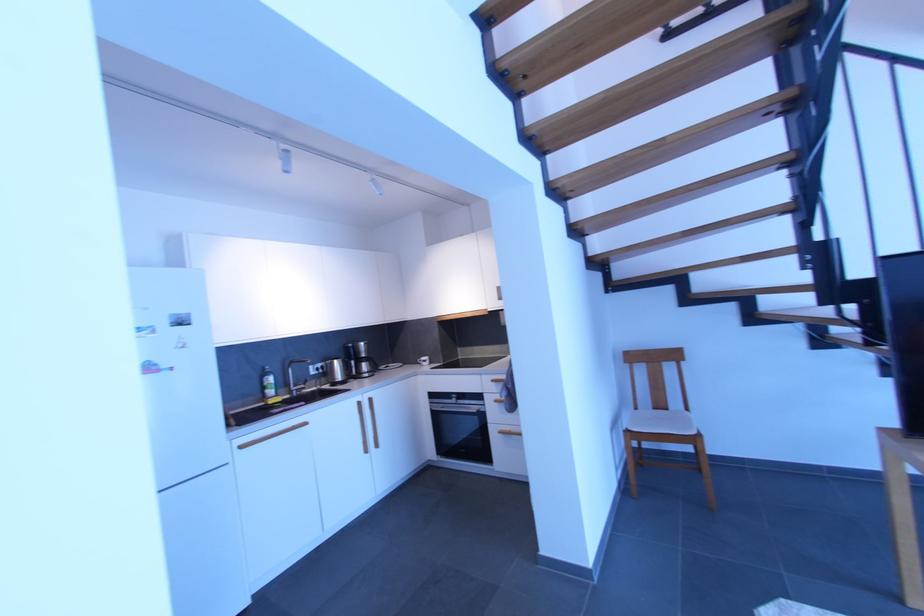
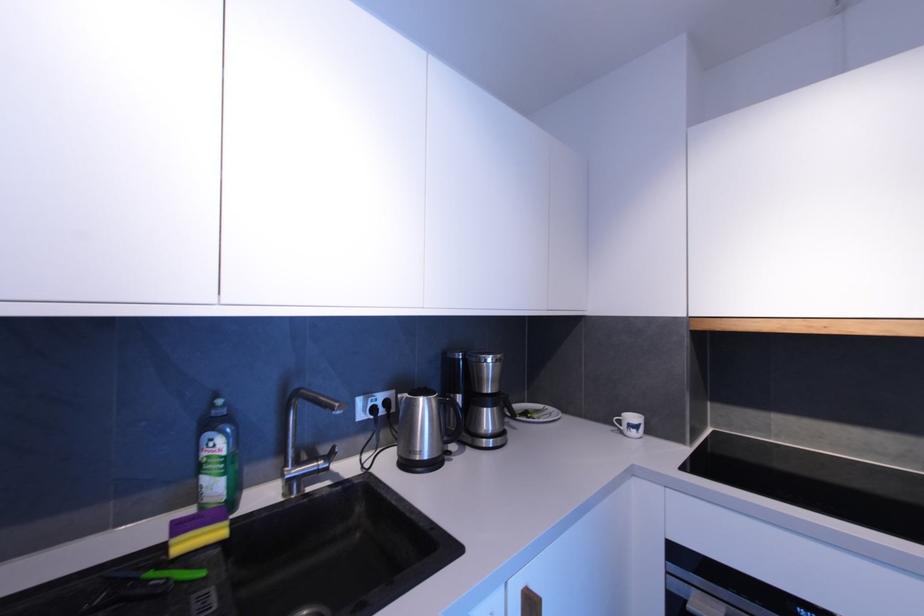
In the second image, find the point that corresponds to (x=272, y=392) in the first image.

(210, 482)